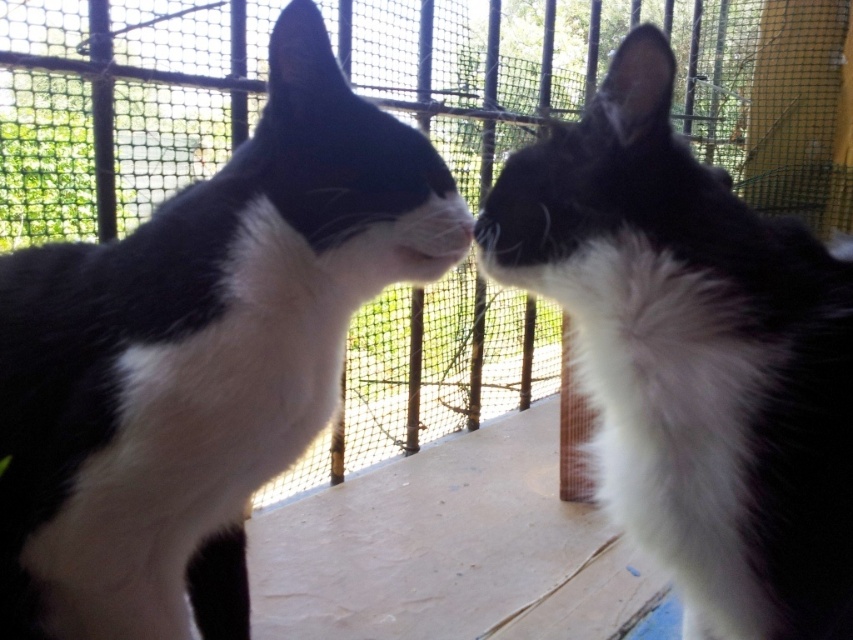
You are a caretaker in an animal shelter. You need to place a small toy between the two cats to keep them occupied. Where should you place the toy so that it is in front of the black and white fur at center but still visible to the black and white fur cat at left?

Place the toy between the black and white fur cat at left and the black and white fur at center. Since the black and white fur at center is behind the black and white fur cat at left, placing the toy in front of the black and white fur at center would mean it is also in front of the black and white fur cat at left, making it visible to both.

From the picture: You are a cat caretaker trying to place a feeding tray between the two cats. The tray requires 30 cm of space. Can the space between the black and white fur cat at left and the black and white fur at center accommodate the tray?

The black and white fur cat at left is wider than the black and white fur at center. However, the description only provides information about their widths, not the distance between them. Therefore, it is unclear if the space between them is sufficient for the 30 cm tray.

You are a veterinarian examining two cats in an indoor enclosure with a mesh fence in the background. You need to identify the cat at the coordinate point (200, 356). Which cat is it?

The point (200, 356) indicates the black and white fur cat at left.